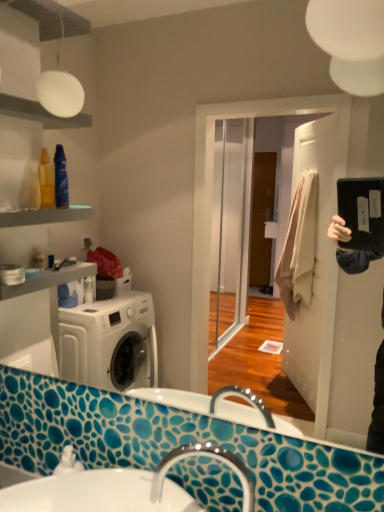
Question: Is point (322, 259) positioned closer to the camera than point (127, 497)?

Choices:
 (A) farther
 (B) closer

Answer: (A)

Question: From a real-world perspective, is matte black mirror at upper right above or below white glossy sink at lower center?

Choices:
 (A) below
 (B) above

Answer: (B)

Question: Which object is the farthest from the silver metallic faucet at lower center?

Choices:
 (A) matte black mirror at upper right
 (B) white glossy sink at lower center

Answer: (A)

Question: Which object is positioned closest to the matte black mirror at upper right?

Choices:
 (A) white glossy sink at lower center
 (B) silver metallic faucet at lower center

Answer: (A)